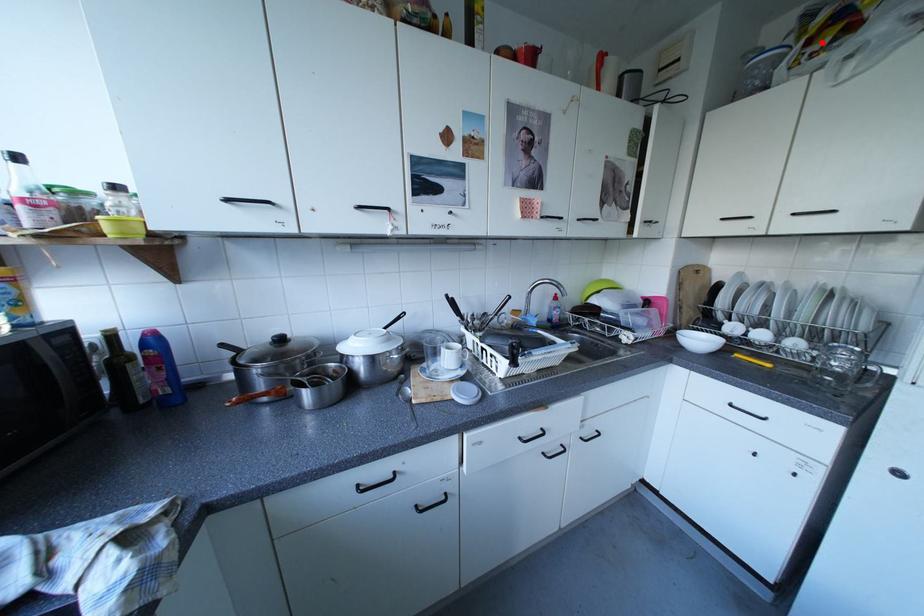
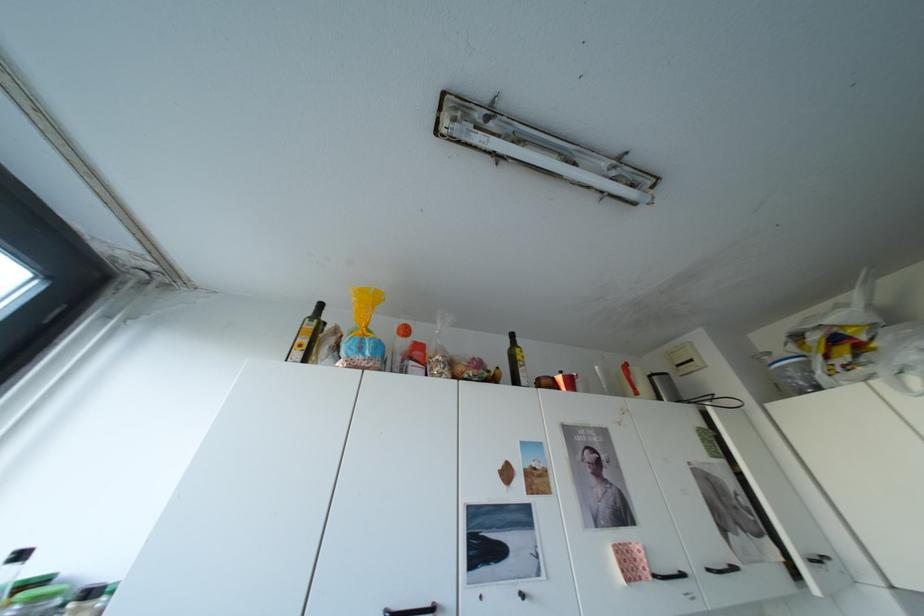
The point at the highlighted location is marked in the first image. Where is the corresponding point in the second image?

(840, 357)